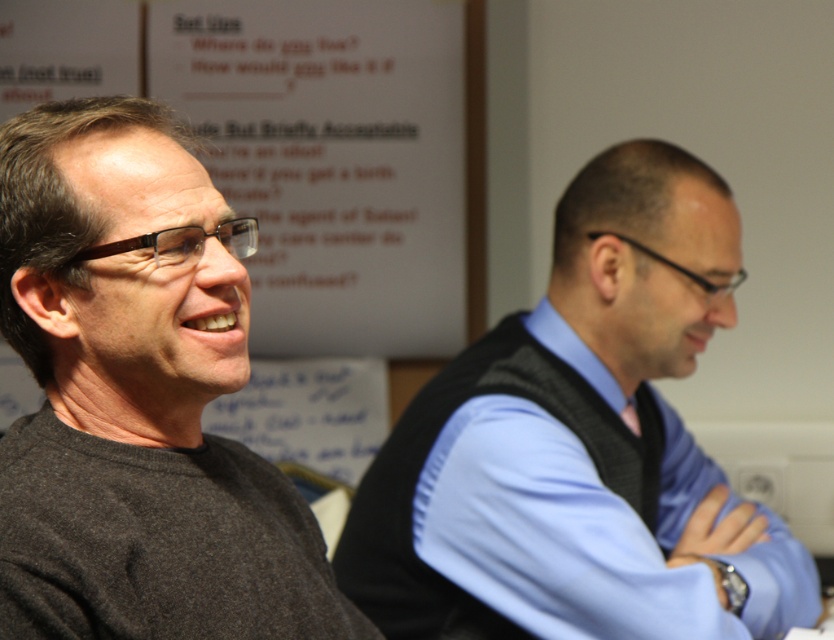
Can you confirm if light blue shirt at right is thinner than dark gray sweater at left?

No.

Who is positioned more to the left, light blue shirt at right or dark gray sweater at left?

Positioned to the left is dark gray sweater at left.

Find the location of `light blue shirt at right`. light blue shirt at right is located at coordinates (581, 445).